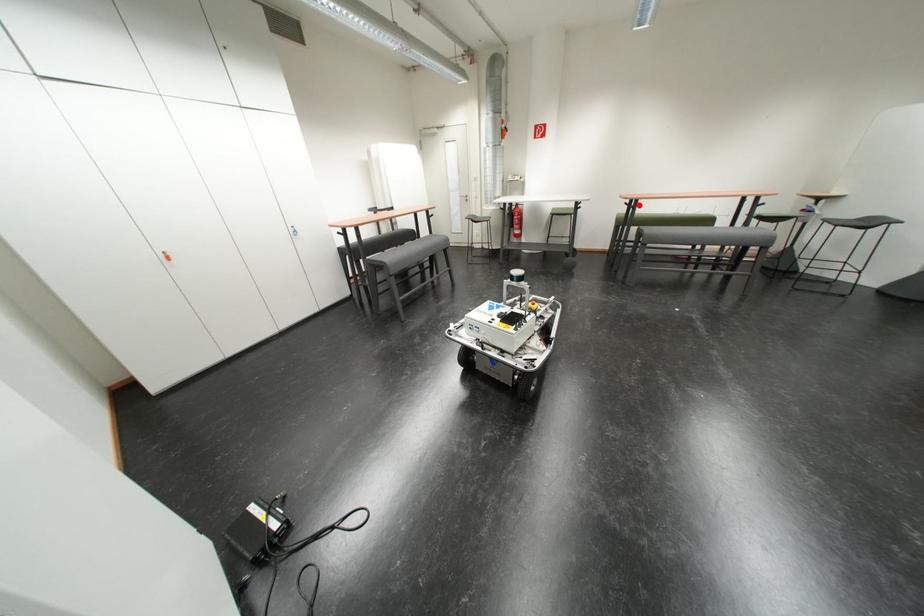
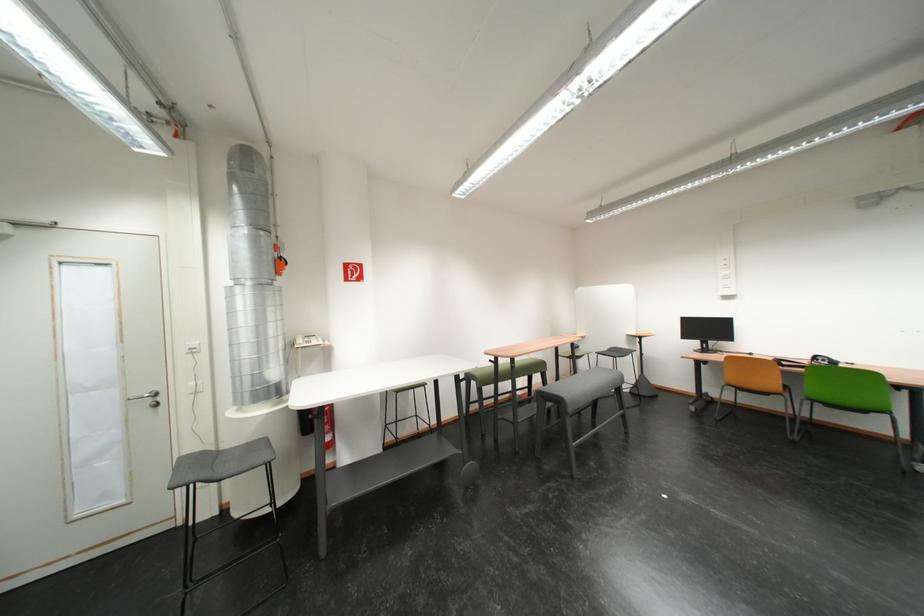
The point at the highlighted location is marked in the first image. Where is the corresponding point in the second image?

(505, 362)